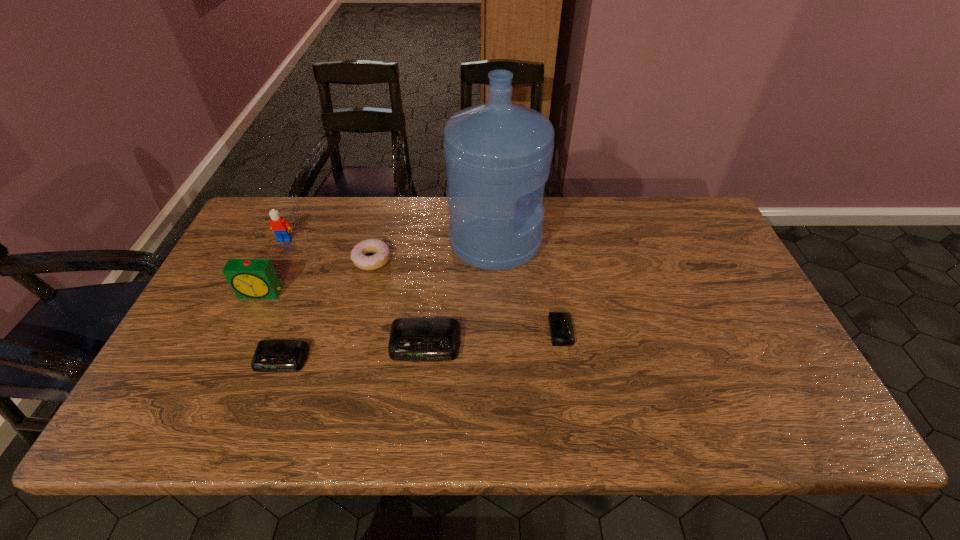
Identify the location of vacant space located 0.340m on the display of the shortest alarm clock. The height and width of the screenshot is (540, 960). (707, 331).

Locate an element on the screen. free space located 0.140m on the side of the tallest object with the handle is located at coordinates (587, 241).

This screenshot has height=540, width=960. Identify the location of free space located on the face of the Lego. (260, 293).

This screenshot has height=540, width=960. In order to click on vacant space positioned 0.050m on the front-facing side of the leftmost alarm clock in this screenshot , I will do `click(252, 314)`.

Where is `free space located on the back of the fourth object from right to left`? The image size is (960, 540). free space located on the back of the fourth object from right to left is located at coordinates (378, 235).

Locate an element on the screen. water jug that is at the far edge is located at coordinates (498, 154).

Find the location of a particular element. Lego that is positioned at the far edge is located at coordinates (281, 227).

Where is `object positioned at the near edge`? The height and width of the screenshot is (540, 960). object positioned at the near edge is located at coordinates (270, 355).

At what (x,y) coordinates should I click in order to perform the action: click on Lego at the left edge. Please return your answer as a coordinate pair (x, y). The width and height of the screenshot is (960, 540). Looking at the image, I should click on (281, 227).

Identify the location of alarm clock at the left edge. The image size is (960, 540). (249, 278).